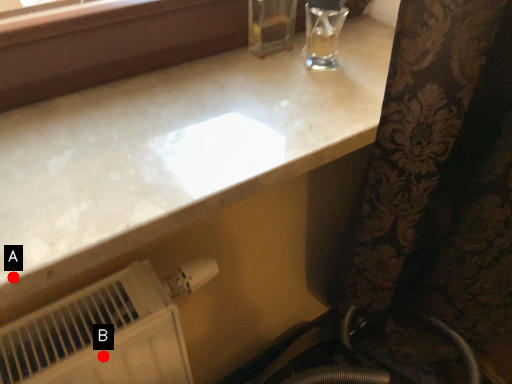
Question: Two points are circled on the image, labeled by A and B beside each circle. Which of the following is the farthest from the observer?

Choices:
 (A) A is further
 (B) B is further

Answer: (B)